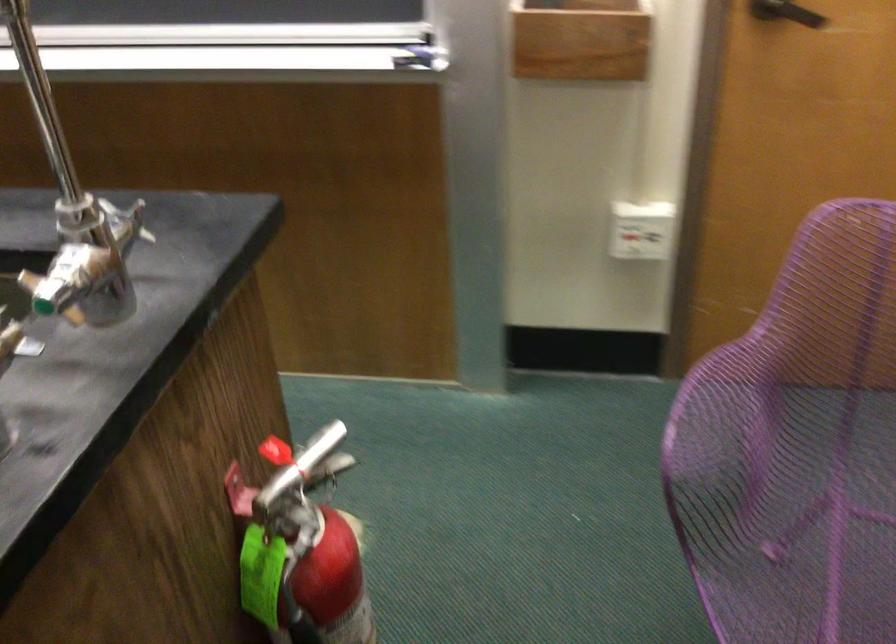
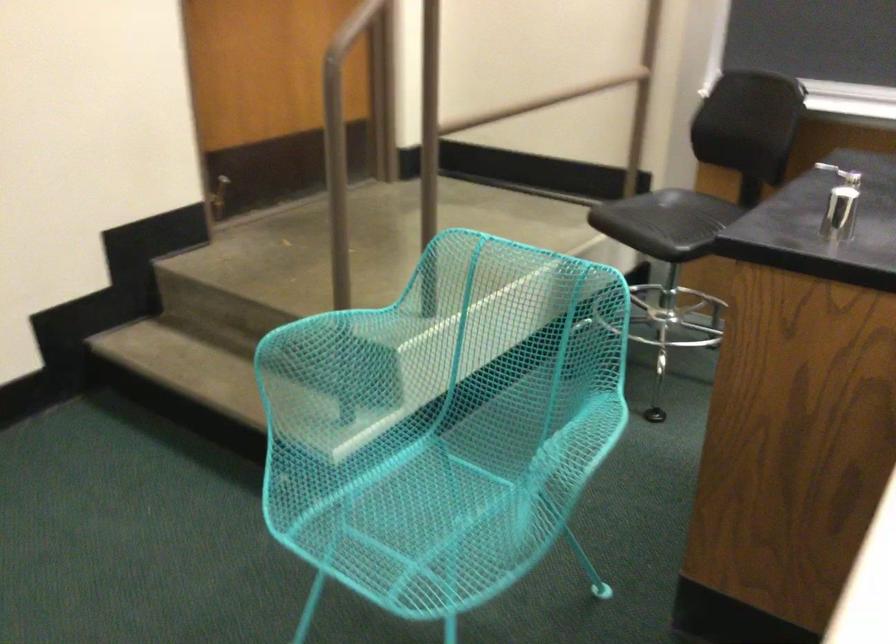
Question: Which direction would the cameraman need to move to produce the second image? Reply with the corresponding letter.

Choices:
 (A) Left
 (B) Right
 (C) Forward
 (D) Backward

Answer: (A)